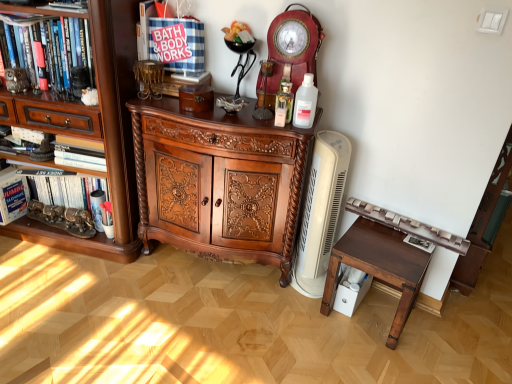
The height and width of the screenshot is (384, 512). I want to click on vacant area that is situated to the right of dark brown wooden table at right, so click(446, 332).